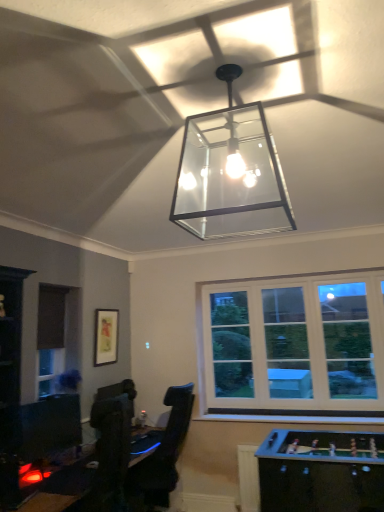
Question: Visually, is matte black picture frame at upper left positioned to the left or to the right of wooden foosball table at lower right, placed as the first table when sorted from right to left?

Choices:
 (A) left
 (B) right

Answer: (A)

Question: From a real-world perspective, relative to wooden foosball table at lower right, which ranks as the 2th table in left-to-right order, is matte black picture frame at upper left vertically above or below?

Choices:
 (A) below
 (B) above

Answer: (B)

Question: Which object is the closest to the wooden foosball table at lower right, placed as the first table when sorted from right to left?

Choices:
 (A) matte black picture frame at upper left
 (B) matte black monitor at lower left
 (C) clear glass pendant light at center
 (D) black glossy table at lower left, the 1th table when ordered from left to right

Answer: (B)

Question: Which object is the closest to the matte black monitor at lower left?

Choices:
 (A) wooden foosball table at lower right, placed as the first table when sorted from right to left
 (B) matte black picture frame at upper left
 (C) black glossy table at lower left, the 1th table when ordered from left to right
 (D) clear glass pendant light at center

Answer: (C)